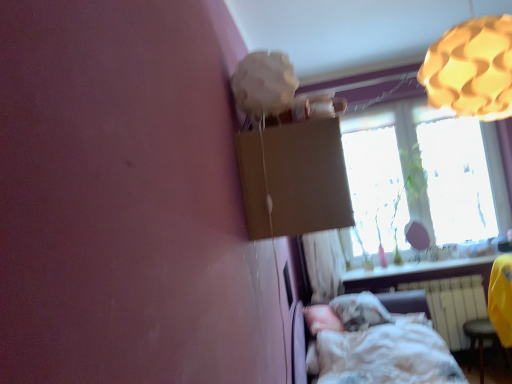
The image size is (512, 384). Describe the element at coordinates (494, 312) in the screenshot. I see `yellow fabric swivel chair at lower right` at that location.

What do you see at coordinates (453, 305) in the screenshot? This screenshot has width=512, height=384. I see `white matte radiator at lower right` at bounding box center [453, 305].

In order to click on brown cardboard box at upper center in this screenshot , I will do `click(293, 179)`.

This screenshot has height=384, width=512. Describe the element at coordinates (293, 179) in the screenshot. I see `brown cardboard box at upper center` at that location.

Describe the element at coordinates (472, 69) in the screenshot. I see `matte yellow lampshade at upper right, which is counted as the 1th lamp, starting from the right` at that location.

Describe the element at coordinates (482, 341) in the screenshot. I see `yellow plastic stool at lower right` at that location.

How much space does white paper lampshade at upper center, which ranks as the 2th lamp in right-to-left order, occupy horizontally?

white paper lampshade at upper center, which ranks as the 2th lamp in right-to-left order, is 10.60 inches wide.

Where is `yellow fabric swivel chair at lower right`? The width and height of the screenshot is (512, 384). yellow fabric swivel chair at lower right is located at coordinates (494, 312).

From a real-world perspective, between white cotton bed at lower right and white paper lampshade at upper center, which ranks as the 2th lamp in right-to-left order, who is vertically higher?

white paper lampshade at upper center, which ranks as the 2th lamp in right-to-left order.

From the picture: Does white cotton bed at lower right have a greater height compared to white paper lampshade at upper center, which ranks as the 2th lamp in right-to-left order?

In fact, white cotton bed at lower right may be shorter than white paper lampshade at upper center, which ranks as the 2th lamp in right-to-left order.

Do you think white cotton bed at lower right is within white paper lampshade at upper center, placed as the 1th lamp when sorted from left to right, or outside of it?

white cotton bed at lower right is not enclosed by white paper lampshade at upper center, placed as the 1th lamp when sorted from left to right.

Considering the positions of objects white cotton bed at lower right and white paper lampshade at upper center, which ranks as the 2th lamp in right-to-left order, in the image provided, who is behind, white cotton bed at lower right or white paper lampshade at upper center, which ranks as the 2th lamp in right-to-left order,?

white cotton bed at lower right is behind.

Can you confirm if white matte radiator at lower right is positioned to the right of yellow fabric swivel chair at lower right?

No.

Consider the image. From a real-world perspective, is white matte radiator at lower right on top of yellow fabric swivel chair at lower right?

No.

Is white matte radiator at lower right outside of yellow fabric swivel chair at lower right?

Yes.

Does white matte radiator at lower right have a larger size compared to yellow fabric swivel chair at lower right?

Incorrect, white matte radiator at lower right is not larger than yellow fabric swivel chair at lower right.

Is point (446, 377) positioned before point (400, 208)?

That is True.

Is white cotton bed at lower right taller than translucent glass window at upper right?

No, white cotton bed at lower right is not taller than translucent glass window at upper right.

From the picture: Is white cotton bed at lower right at the left side of translucent glass window at upper right?

Yes, white cotton bed at lower right is to the left of translucent glass window at upper right.

Is yellow fabric swivel chair at lower right turned away from yellow plastic stool at lower right?

No, yellow fabric swivel chair at lower right's orientation is not away from yellow plastic stool at lower right.

Considering the positions of objects yellow fabric swivel chair at lower right and yellow plastic stool at lower right in the image provided, who is more to the right, yellow fabric swivel chair at lower right or yellow plastic stool at lower right?

Positioned to the right is yellow plastic stool at lower right.

Which object is more forward, yellow fabric swivel chair at lower right or yellow plastic stool at lower right?

yellow fabric swivel chair at lower right is in front.

Does translucent glass window at upper right turn towards smooth white window sill at lower right?

Yes.

Looking at their sizes, would you say translucent glass window at upper right is wider or thinner than smooth white window sill at lower right?

Clearly, translucent glass window at upper right has less width compared to smooth white window sill at lower right.

Considering the sizes of translucent glass window at upper right and smooth white window sill at lower right in the image, is translucent glass window at upper right taller or shorter than smooth white window sill at lower right?

translucent glass window at upper right is taller than smooth white window sill at lower right.

From the image's perspective, between translucent glass window at upper right and smooth white window sill at lower right, who is located below?

From the image's view, smooth white window sill at lower right is below.

At what (x,y) coordinates should I click in order to perform the action: click on window sill on the right of translucent glass window at upper right. Please return your answer as a coordinate pair (x, y). This screenshot has height=384, width=512. Looking at the image, I should click on (414, 268).

What's the angular difference between smooth white window sill at lower right and translucent glass window at upper right's facing directions?

0.225 degrees separate the facing orientations of smooth white window sill at lower right and translucent glass window at upper right.

Is smooth white window sill at lower right taller or shorter than translucent glass window at upper right?

Clearly, smooth white window sill at lower right is shorter compared to translucent glass window at upper right.

Is the surface of smooth white window sill at lower right in direct contact with translucent glass window at upper right?

No, smooth white window sill at lower right is not beside translucent glass window at upper right.

Is white paper lampshade at upper center, which ranks as the 2th lamp in right-to-left order, surrounded by brown cardboard box at upper center?

No.

Which object is further away from the camera taking this photo, brown cardboard box at upper center or white paper lampshade at upper center, placed as the 1th lamp when sorted from left to right?

white paper lampshade at upper center, placed as the 1th lamp when sorted from left to right, is further away from the camera.

From the image's perspective, is brown cardboard box at upper center located above or below white paper lampshade at upper center, which ranks as the 2th lamp in right-to-left order?

brown cardboard box at upper center is situated lower than white paper lampshade at upper center, which ranks as the 2th lamp in right-to-left order, in the image.

From a real-world perspective, starting from the brown cardboard box at upper center, which lamp is the 1st one vertically above it? Please provide its 2D coordinates.

[(264, 83)]

Find the location of a particular element. furniture to the right of white paper lampshade at upper center, placed as the 1th lamp when sorted from left to right is located at coordinates (376, 346).

Locate an element on the screen. The image size is (512, 384). radiator that appears below the yellow fabric swivel chair at lower right (from the image's perspective) is located at coordinates (453, 305).

In the scene shown: Considering their positions, is smooth white window sill at lower right positioned further to yellow fabric swivel chair at lower right than white paper lampshade at upper center, placed as the 1th lamp when sorted from left to right?

white paper lampshade at upper center, placed as the 1th lamp when sorted from left to right.

From the image, which object appears to be farther from white matte radiator at lower right, white paper lampshade at upper center, placed as the 1th lamp when sorted from left to right, or smooth white window sill at lower right?

white paper lampshade at upper center, placed as the 1th lamp when sorted from left to right, is positioned further to the anchor white matte radiator at lower right.

Based on their spatial positions, is yellow plastic stool at lower right or translucent glass window at upper right further from brown cardboard box at upper center?

Based on the image, yellow plastic stool at lower right appears to be further to brown cardboard box at upper center.

Looking at the image, which one is located closer to white cotton bed at lower right, white matte radiator at lower right or matte yellow lampshade at upper right, which is the 2th lamp from left to right?

Among the two, white matte radiator at lower right is located nearer to white cotton bed at lower right.

Which object lies further to the anchor point smooth white window sill at lower right, yellow plastic stool at lower right or white matte radiator at lower right?

The object further to smooth white window sill at lower right is yellow plastic stool at lower right.

Estimate the real-world distances between objects in this image. Which object is closer to translucent glass window at upper right, white cotton bed at lower right or yellow fabric swivel chair at lower right?

Among the two, yellow fabric swivel chair at lower right is located nearer to translucent glass window at upper right.

From the image, which object appears to be nearer to matte yellow lampshade at upper right, which is the 2th lamp from left to right, white cotton bed at lower right or yellow plastic stool at lower right?

Based on the image, white cotton bed at lower right appears to be nearer to matte yellow lampshade at upper right, which is the 2th lamp from left to right.

When comparing their distances from white matte radiator at lower right, does brown cardboard box at upper center or yellow plastic stool at lower right seem further?

The object further to white matte radiator at lower right is brown cardboard box at upper center.

Where is `furniture located between brown cardboard box at upper center and white matte radiator at lower right in the depth direction`? The height and width of the screenshot is (384, 512). furniture located between brown cardboard box at upper center and white matte radiator at lower right in the depth direction is located at coordinates tap(376, 346).

Where is `stool between white paper lampshade at upper center, which ranks as the 2th lamp in right-to-left order, and smooth white window sill at lower right, along the z-axis`? Image resolution: width=512 pixels, height=384 pixels. stool between white paper lampshade at upper center, which ranks as the 2th lamp in right-to-left order, and smooth white window sill at lower right, along the z-axis is located at coordinates (482, 341).

Find the location of a particular element. radiator between white paper lampshade at upper center, placed as the 1th lamp when sorted from left to right, and smooth white window sill at lower right from front to back is located at coordinates (453, 305).

Locate an element on the screen. The width and height of the screenshot is (512, 384). furniture between white paper lampshade at upper center, placed as the 1th lamp when sorted from left to right, and yellow plastic stool at lower right from top to bottom is located at coordinates (376, 346).